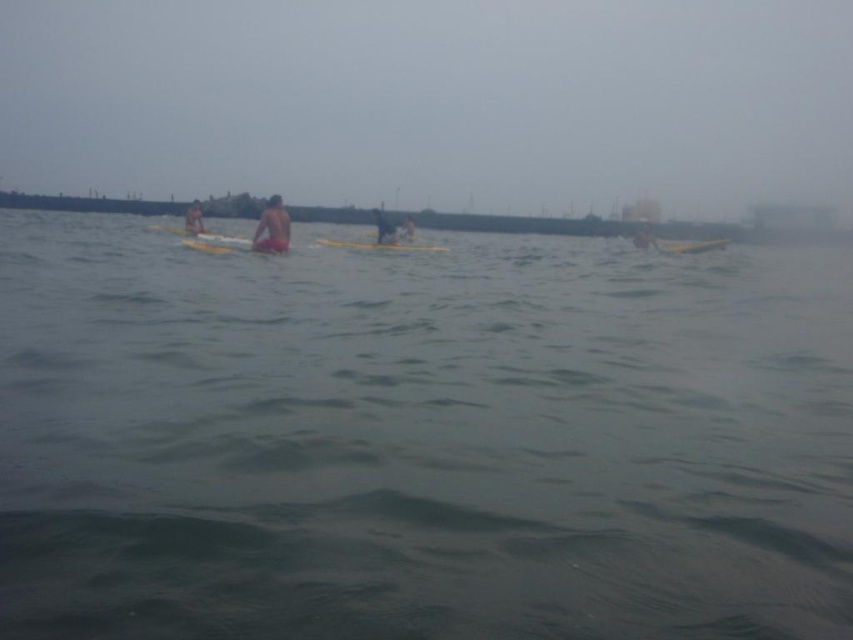
Question: Which point appears closest to the camera in this image?

Choices:
 (A) (199, 230)
 (B) (125, 524)
 (C) (263, 240)

Answer: (B)

Question: Can you confirm if yellow foam at center is positioned to the left of smooth yellow surfboard at center?

Choices:
 (A) yes
 (B) no

Answer: (A)

Question: Does orange fabric person at center appear on the right side of smooth yellow surfboard at center?

Choices:
 (A) yes
 (B) no

Answer: (B)

Question: Which point is farther from the camera taking this photo?

Choices:
 (A) (372, 212)
 (B) (280, 237)
 (C) (405, 227)
 (D) (398, 244)

Answer: (A)

Question: Which object is closer to the camera taking this photo?

Choices:
 (A) yellow foam canoe at center
 (B) green water at center

Answer: (B)

Question: Is yellow foam at center to the right of smooth yellow surfboard at center from the viewer's perspective?

Choices:
 (A) no
 (B) yes

Answer: (A)